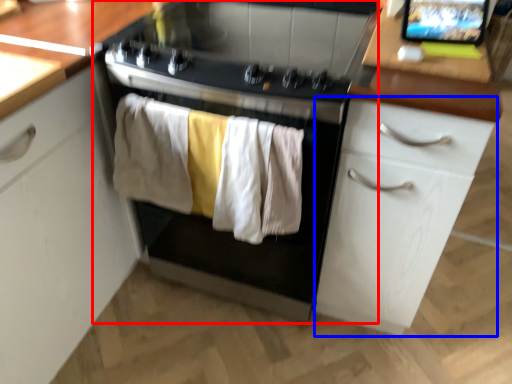
Question: Among these objects, which one is farthest to the camera, home appliance (highlighted by a red box) or cabinetry (highlighted by a blue box)?

Choices:
 (A) home appliance
 (B) cabinetry

Answer: (A)